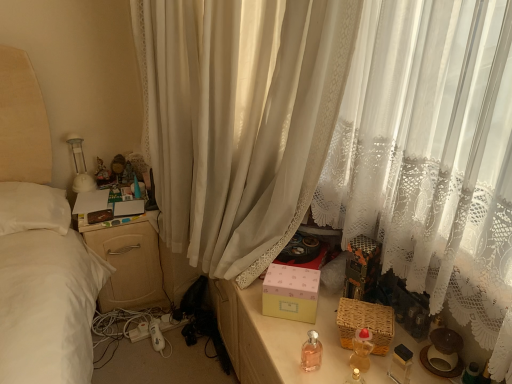
Question: Can you confirm if translucent plastic baby bottle at lower right, placed as the first baby bottle when sorted from right to left, is thinner than woven brown basket at lower right?

Choices:
 (A) yes
 (B) no

Answer: (A)

Question: Could you tell me if translucent plastic baby bottle at lower right, the second baby bottle positioned from the left, is facing woven brown basket at lower right?

Choices:
 (A) yes
 (B) no

Answer: (B)

Question: Would you consider translucent plastic baby bottle at lower right, placed as the first baby bottle when sorted from right to left, to be distant from woven brown basket at lower right?

Choices:
 (A) yes
 (B) no

Answer: (B)

Question: From the image's perspective, is translucent plastic baby bottle at lower right, placed as the first baby bottle when sorted from right to left, on woven brown basket at lower right?

Choices:
 (A) no
 (B) yes

Answer: (A)

Question: Is translucent plastic baby bottle at lower right, the second baby bottle positioned from the left, completely or partially outside of woven brown basket at lower right?

Choices:
 (A) no
 (B) yes

Answer: (B)

Question: From a real-world perspective, relative to translucent plastic baby bottle at lower right, placed as the first baby bottle when sorted from right to left, is pink matte box at center vertically above or below?

Choices:
 (A) above
 (B) below

Answer: (B)

Question: In terms of width, does pink matte box at center look wider or thinner when compared to translucent plastic baby bottle at lower right, placed as the first baby bottle when sorted from right to left?

Choices:
 (A) wide
 (B) thin

Answer: (A)

Question: In terms of size, does pink matte box at center appear bigger or smaller than translucent plastic baby bottle at lower right, the second baby bottle positioned from the left?

Choices:
 (A) big
 (B) small

Answer: (A)

Question: Considering the positions of pink matte box at center and translucent plastic baby bottle at lower right, the second baby bottle positioned from the left, in the image, is pink matte box at center taller or shorter than translucent plastic baby bottle at lower right, the second baby bottle positioned from the left,?

Choices:
 (A) tall
 (B) short

Answer: (A)

Question: Does point (355, 334) appear closer or farther from the camera than point (258, 183)?

Choices:
 (A) farther
 (B) closer

Answer: (B)

Question: From the image's perspective, is translucent plastic baby bottle at lower right, the second baby bottle positioned from the left, located above or below white sheer curtain at center?

Choices:
 (A) below
 (B) above

Answer: (A)

Question: Do you think translucent plastic baby bottle at lower right, placed as the first baby bottle when sorted from right to left, is within white sheer curtain at center, or outside of it?

Choices:
 (A) outside
 (B) inside

Answer: (A)

Question: Looking at their shapes, would you say translucent plastic baby bottle at lower right, the second baby bottle positioned from the left, is wider or thinner than white sheer curtain at center?

Choices:
 (A) wide
 (B) thin

Answer: (B)

Question: From a real-world perspective, is pink matte box at center above or below white sheer curtain at center?

Choices:
 (A) below
 (B) above

Answer: (A)

Question: Looking at the image, does pink matte box at center seem bigger or smaller compared to white sheer curtain at center?

Choices:
 (A) big
 (B) small

Answer: (B)